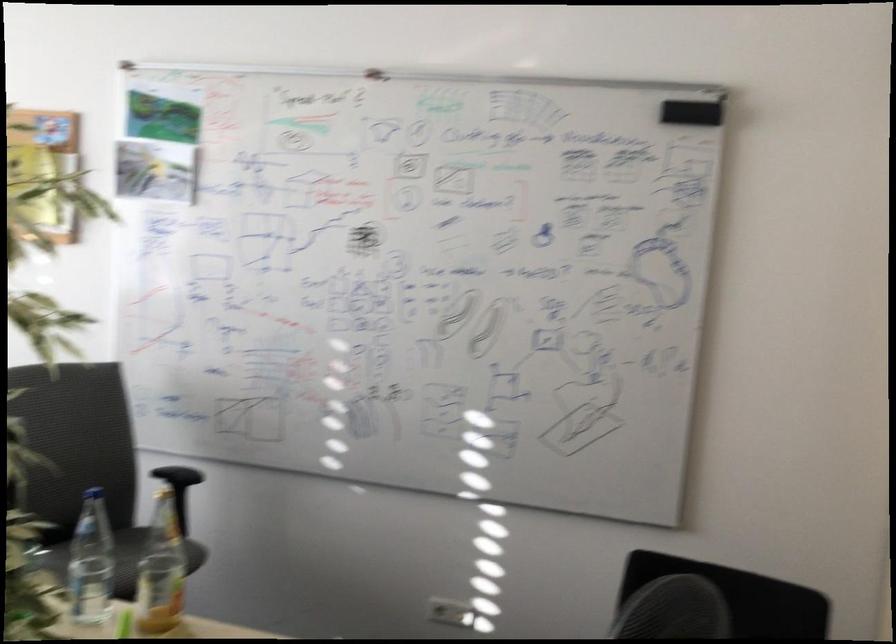
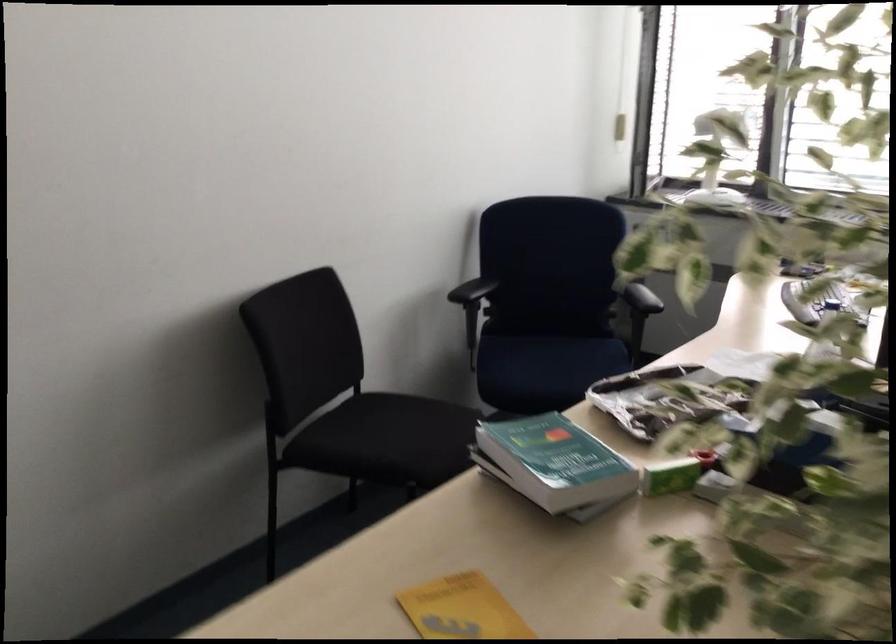
Looking at this image, the images are taken continuously from a first-person perspective. In which direction is your viewpoint rotating?

The camera's rotation is toward left-down.